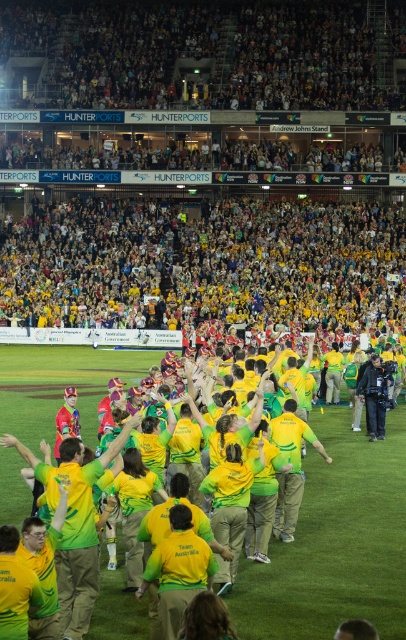
Question: Is green matte jersey at center positioned at the back of dark blue jeans at lower right?

Choices:
 (A) yes
 (B) no

Answer: (B)

Question: Which point is closer to the camera taking this photo?

Choices:
 (A) 285,422
 (B) 371,362

Answer: (A)

Question: Among these points, which one is nearest to the camera?

Choices:
 (A) (378, 372)
 (B) (282, 451)

Answer: (B)

Question: Where is green matte jersey at center located in relation to dark blue jeans at lower right in the image?

Choices:
 (A) above
 (B) below

Answer: (B)

Question: Does green matte jersey at center appear on the right side of dark blue jeans at lower right?

Choices:
 (A) no
 (B) yes

Answer: (A)